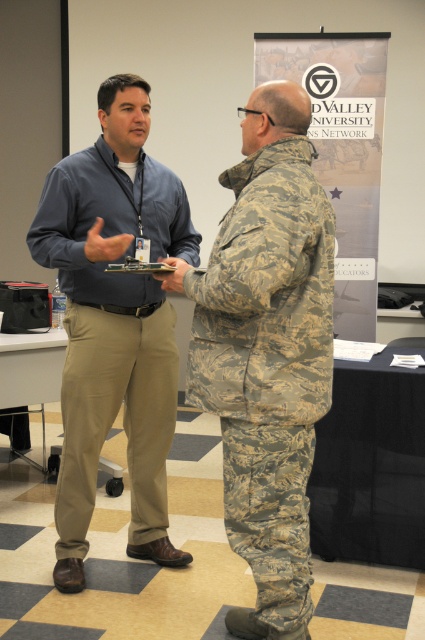
Question: Is camouflage fabric uniform at center below matte blue shirt at center?

Choices:
 (A) yes
 (B) no

Answer: (A)

Question: Which point is closer to the camera?

Choices:
 (A) camouflage fabric uniform at center
 (B) matte blue shirt at center

Answer: (A)

Question: Which object is farther from the camera taking this photo?

Choices:
 (A) camouflage fabric uniform at center
 (B) matte blue shirt at center

Answer: (B)

Question: Which point is closer to the camera?

Choices:
 (A) matte blue shirt at center
 (B) camouflage fabric uniform at center

Answer: (B)

Question: Can you confirm if camouflage fabric uniform at center is smaller than matte blue shirt at center?

Choices:
 (A) yes
 (B) no

Answer: (A)

Question: Does camouflage fabric uniform at center have a larger size compared to matte blue shirt at center?

Choices:
 (A) no
 (B) yes

Answer: (A)